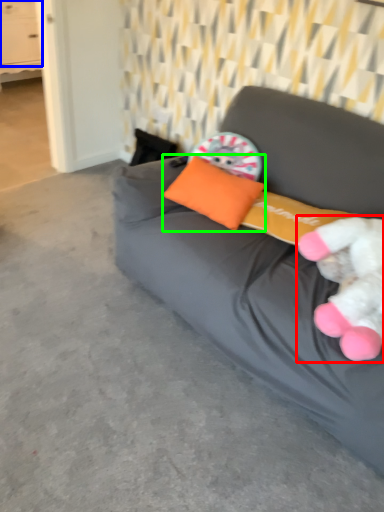
Question: Which object is positioned farthest from toy (highlighted by a red box)? Select from drawer (highlighted by a blue box) and pillow (highlighted by a green box).

Choices:
 (A) drawer
 (B) pillow

Answer: (A)